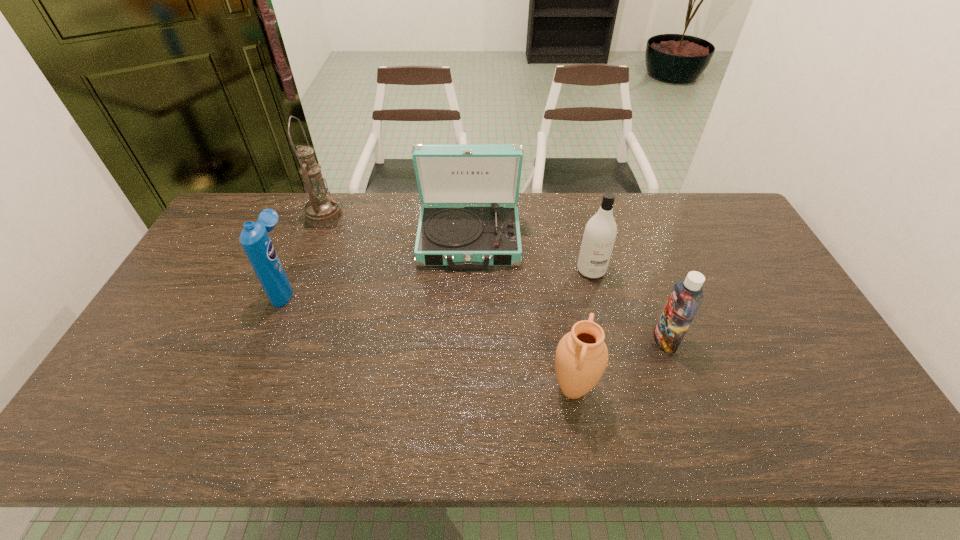
Identify the location of blank region between the leftmost shampoo and the second shampoo from right to left. This screenshot has width=960, height=540. (439, 279).

You are a GUI agent. You are given a task and a screenshot of the screen. Output one action in this format:
    pyautogui.click(x=<x>, y=<y>)
    Task: Click on the blank region between the tallest object and the fifth farthest object
    The image size is (960, 540).
    Given the screenshot: What is the action you would take?
    pyautogui.click(x=494, y=278)

Locate an element on the screen. The width and height of the screenshot is (960, 540). the fifth closest object to the nearest object is located at coordinates (321, 211).

Find the location of a particular element. This screenshot has width=960, height=540. object that is the fifth closest to the tallest object is located at coordinates (686, 297).

Select which shampoo is the closest to the oil lamp. Please provide its 2D coordinates. Your answer should be formatted as a tuple, i.e. [(x, y)], where the tuple contains the x and y coordinates of a point satisfying the conditions above.

[(254, 238)]

Locate which shampoo is the second closest to the leftmost shampoo. Please provide its 2D coordinates. Your answer should be formatted as a tuple, i.e. [(x, y)], where the tuple contains the x and y coordinates of a point satisfying the conditions above.

[(686, 297)]

Where is `vacant space that satisfies the following two spatial constraints: 1. on the face side of the third object from left to right; 2. on the right side of the nearest object`? vacant space that satisfies the following two spatial constraints: 1. on the face side of the third object from left to right; 2. on the right side of the nearest object is located at coordinates (466, 389).